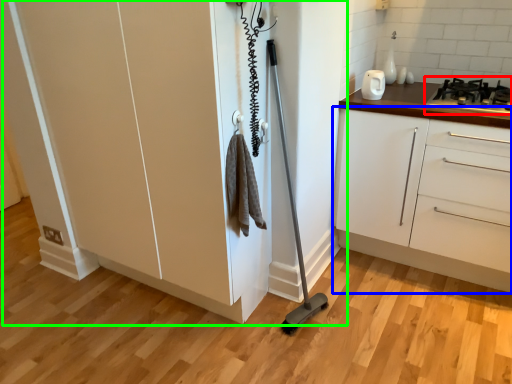
Question: Which object is positioned farthest from gas stove (highlighted by a red box)? Select from cabinetry (highlighted by a blue box) and cupboard (highlighted by a green box).

Choices:
 (A) cabinetry
 (B) cupboard

Answer: (B)